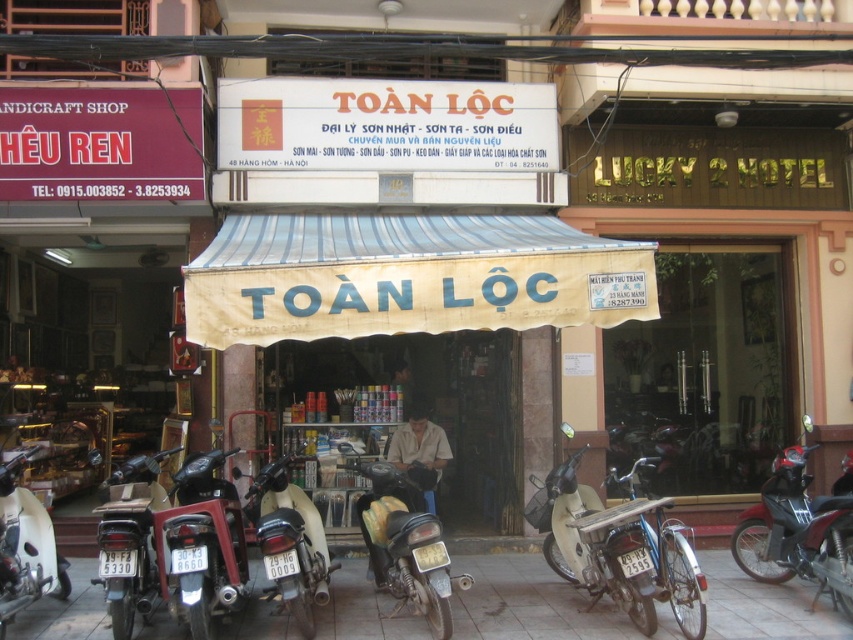
You are a delivery person with a cart that is 1.5 meters wide. You need to move your cart from the shiny black motorcycle at center to the white matte motorcycle at lower left. Is there enough space between the two motorcycles for your cart to pass through?

The distance between the shiny black motorcycle at center and the white matte motorcycle at lower left is 2.21 meters. Since your cart is 1.5 meters wide, there is sufficient space for the cart to pass through as 2.21 meters is greater than 1.5 meters.

You are a delivery person who needs to park your beige matte motorcycle at center and matte black motorcycle at center in front of the shop. The parking space is narrow. Which motorcycle should you park first to ensure both can fit?

You should park the beige matte motorcycle at center first since it is closer to the viewer, meaning it is positioned in front. By parking the closer one first, you can then maneuver the matte black motorcycle at center behind it, ensuring both fit within the narrow space.